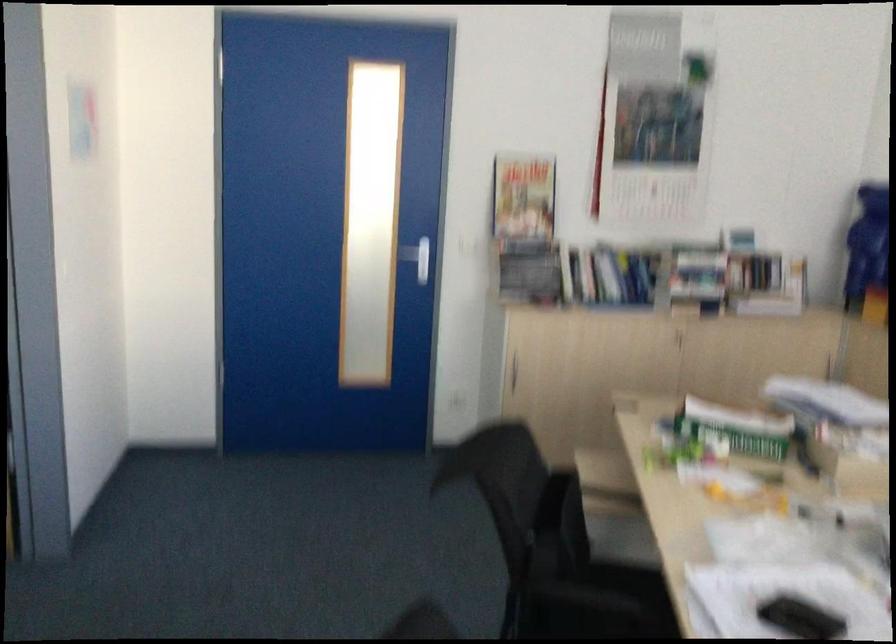
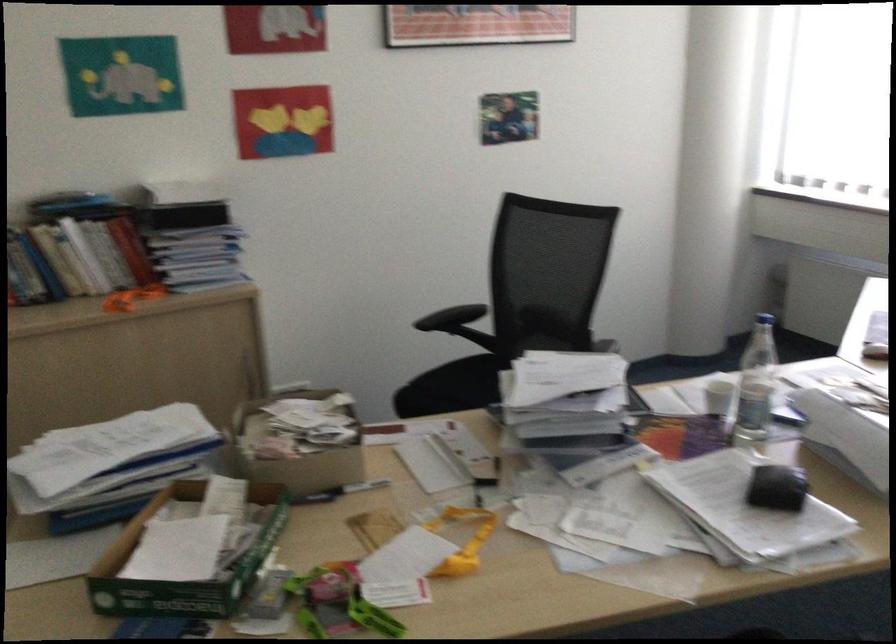
Find the pixel in the second image that matches the point at 702,410 in the first image.

(184, 564)